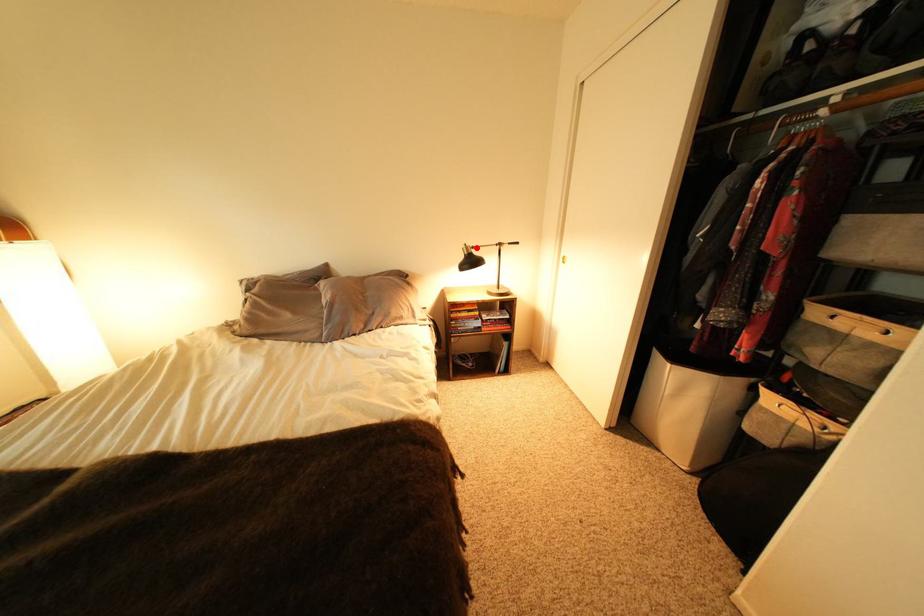
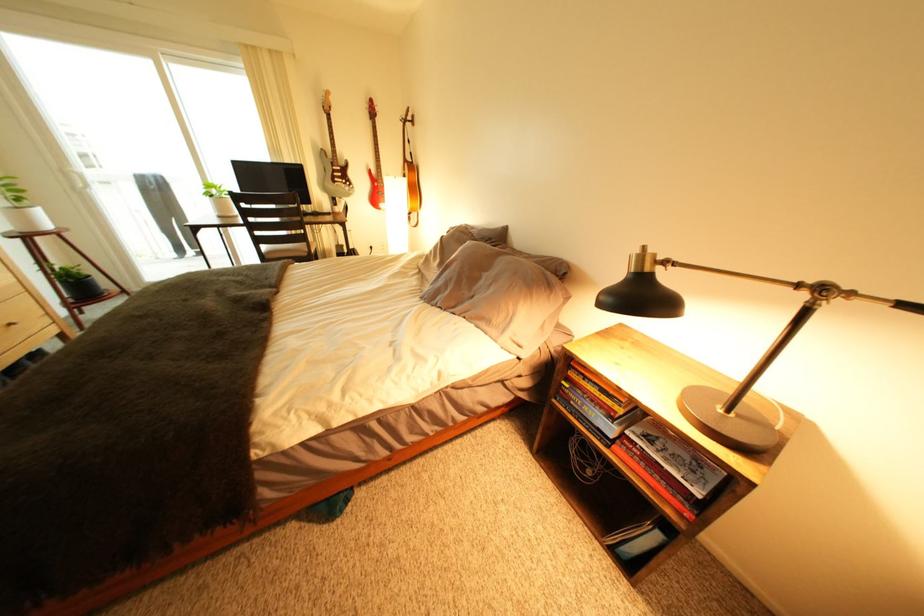
Question: I am providing you with two images of the same scene from different viewpoints. A red point is marked on the first image. At the location where the point appears in image 1, is it still visible in image 2?

Choices:
 (A) Yes
 (B) No

Answer: (A)